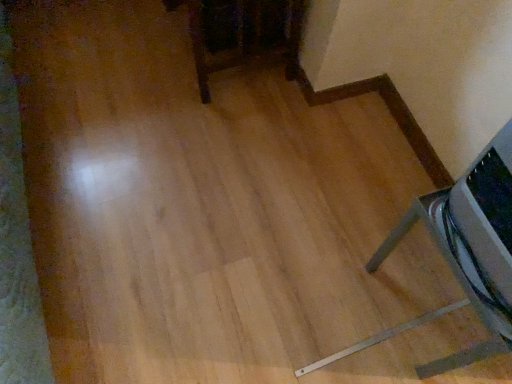
Where is `vacant area that lies between dark wood table at upper center, arranged as the second furniture when viewed from the right, and metallic silver speaker at lower right, placed as the second furniture when sorted from left to right`? The width and height of the screenshot is (512, 384). vacant area that lies between dark wood table at upper center, arranged as the second furniture when viewed from the right, and metallic silver speaker at lower right, placed as the second furniture when sorted from left to right is located at coordinates (320, 177).